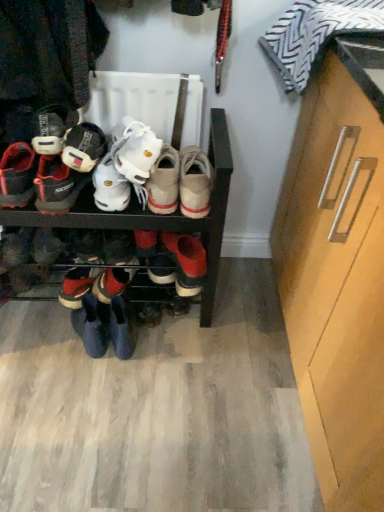
Question: Is light brown suede shoe at center, positioned as the sixth footwear in left-to-right order, in front of shiny black sneakers at lower left, which is the 4th footwear from right to left?

Choices:
 (A) yes
 (B) no

Answer: (A)

Question: Would you say shiny black sneakers at lower left, which is the 4th footwear from right to left, is part of light brown suede shoe at center, positioned as the sixth footwear in left-to-right order,'s contents?

Choices:
 (A) yes
 (B) no

Answer: (B)

Question: From a real-world perspective, is light brown suede shoe at center, positioned as the sixth footwear in left-to-right order, located higher than shiny black sneakers at lower left, which is the 4th footwear from right to left?

Choices:
 (A) yes
 (B) no

Answer: (A)

Question: Is the depth of light brown suede shoe at center, the 1th footwear when ordered from right to left, greater than that of shiny black sneakers at lower left, which is the 4th footwear from right to left?

Choices:
 (A) no
 (B) yes

Answer: (A)

Question: Is light brown suede shoe at center, the 1th footwear when ordered from right to left, facing towards shiny black sneakers at lower left, which is the 4th footwear from right to left?

Choices:
 (A) no
 (B) yes

Answer: (A)

Question: From a real-world perspective, is light brown suede shoe at center, positioned as the sixth footwear in left-to-right order, positioned under shiny black sneakers at lower left, which is the 4th footwear from right to left, based on gravity?

Choices:
 (A) no
 (B) yes

Answer: (A)

Question: From a real-world perspective, is striped fabric pillow at upper right on matte black shoe at left, arranged as the 5th footwear when viewed from the right?

Choices:
 (A) yes
 (B) no

Answer: (A)

Question: Can you confirm if striped fabric pillow at upper right is positioned to the right of matte black shoe at left, arranged as the 5th footwear when viewed from the right?

Choices:
 (A) no
 (B) yes

Answer: (B)

Question: Does striped fabric pillow at upper right have a lesser height compared to matte black shoe at left, arranged as the 5th footwear when viewed from the right?

Choices:
 (A) no
 (B) yes

Answer: (A)

Question: Does striped fabric pillow at upper right come behind matte black shoe at left, which is counted as the 2th footwear, starting from the left?

Choices:
 (A) yes
 (B) no

Answer: (B)

Question: From a real-world perspective, is striped fabric pillow at upper right physically below matte black shoe at left, which is counted as the 2th footwear, starting from the left?

Choices:
 (A) yes
 (B) no

Answer: (B)

Question: From the image's perspective, is striped fabric pillow at upper right on matte black shoe at left, which is counted as the 2th footwear, starting from the left?

Choices:
 (A) yes
 (B) no

Answer: (A)

Question: From a real-world perspective, is striped fabric pillow at upper right beneath white suede sneakers at center, the fifth footwear from the left?

Choices:
 (A) yes
 (B) no

Answer: (B)